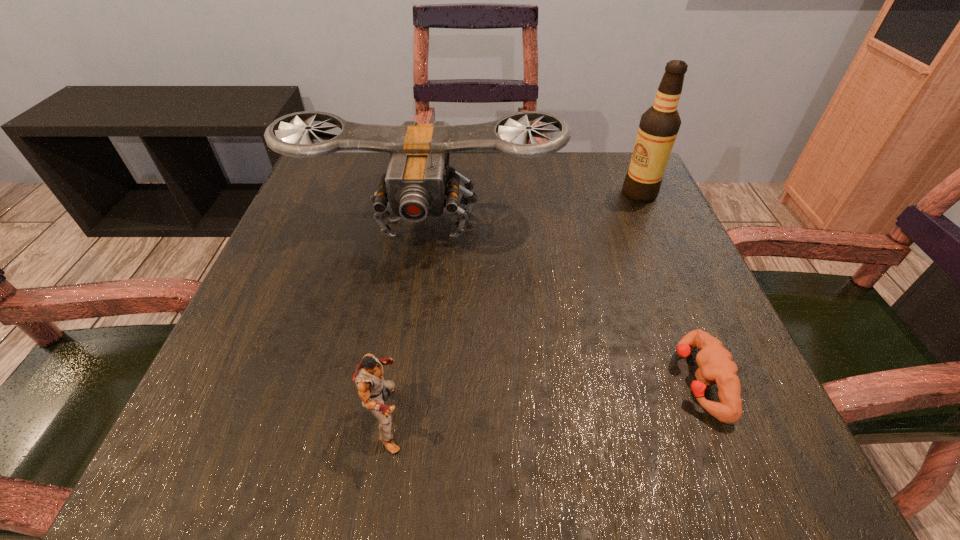
Identify the location of object present at the far right corner. This screenshot has height=540, width=960. (659, 125).

The width and height of the screenshot is (960, 540). What are the coordinates of `object at the near right corner` in the screenshot? It's located at (716, 366).

In order to click on free space at the far edge of the desktop in this screenshot , I will do `click(485, 186)`.

The width and height of the screenshot is (960, 540). In the image, there is a desktop. What are the coordinates of `free region at the near edge` in the screenshot? It's located at (609, 418).

The height and width of the screenshot is (540, 960). I want to click on vacant area at the left edge, so click(309, 403).

The width and height of the screenshot is (960, 540). Find the location of `vacant area at the right edge`. vacant area at the right edge is located at coordinates (618, 235).

Identify the location of vacant area at the far left corner of the desktop. (297, 208).

What are the coordinates of `free space at the near left corner of the desktop` in the screenshot? It's located at (271, 428).

Where is `vacant space at the near right corner of the desktop`? The image size is (960, 540). vacant space at the near right corner of the desktop is located at coordinates (693, 423).

In order to click on free space between the shorter puncher and the taller puncher in this screenshot , I will do tap(543, 399).